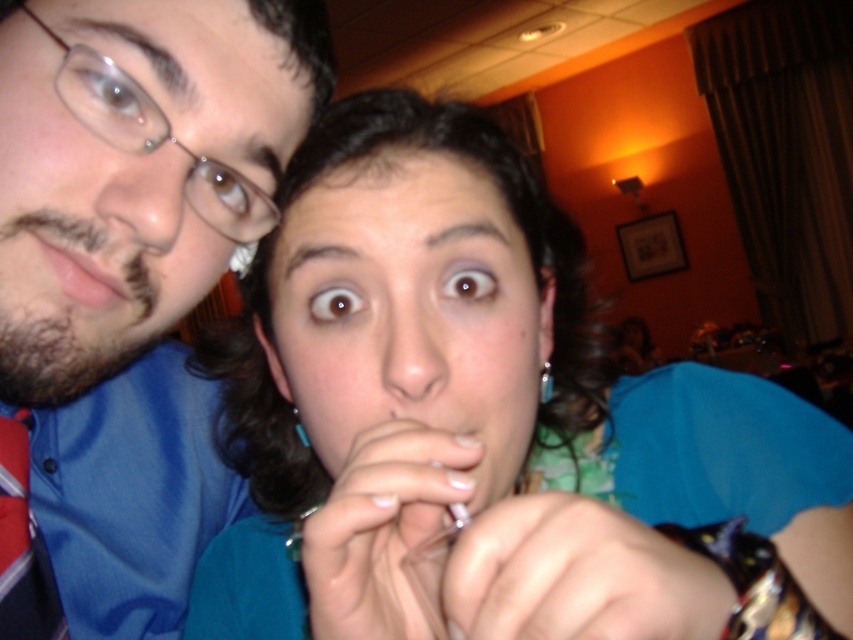
Where is the blue fabric shirt at center located in the image?

The blue fabric shirt at center is located at point 0.659 on the horizontal axis and 0.577 on the vertical axis.

You are a photographer trying to capture a candid shot of the matte pink lips at left and the blue fabric shirt at center. Since you want to focus on both subjects clearly, which one should you adjust your camera focus on first to ensure both are in focus?

The blue fabric shirt at center is in front of matte pink lips at left. To ensure both are in focus, you should focus on the blue fabric shirt at center first, as it is closer to the camera, and the matte pink lips at left will naturally fall into focus behind it.